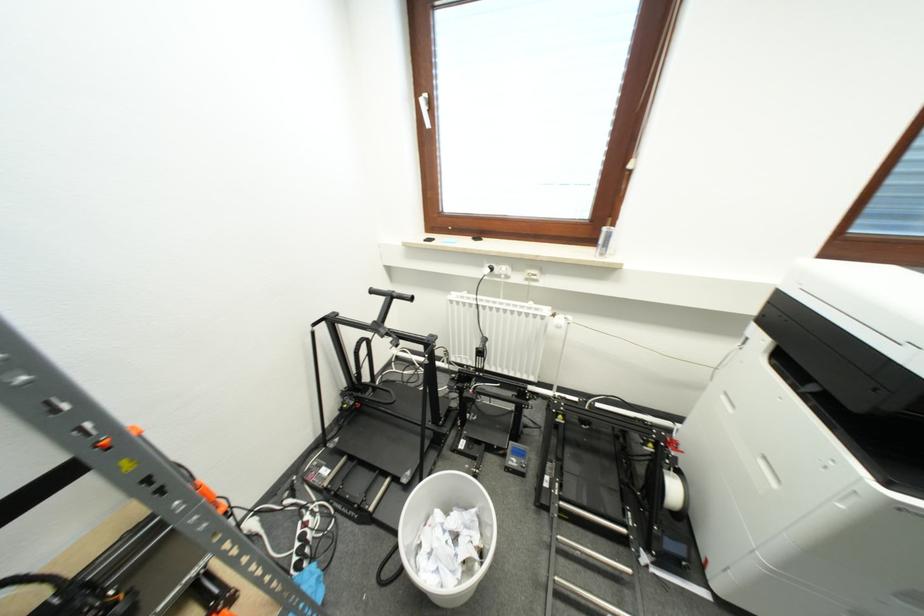
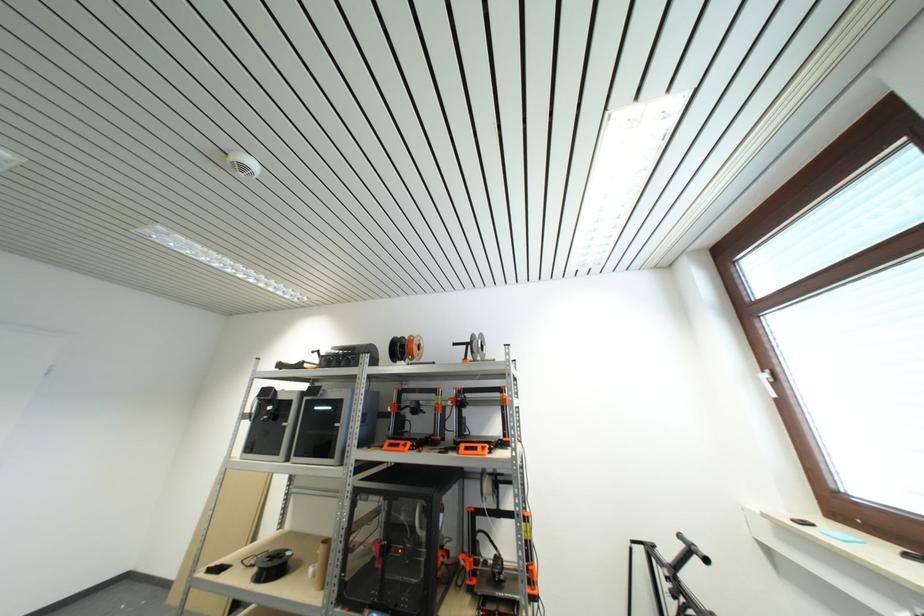
Find the pixel in the second image that matches (377,294) in the first image.

(685, 540)